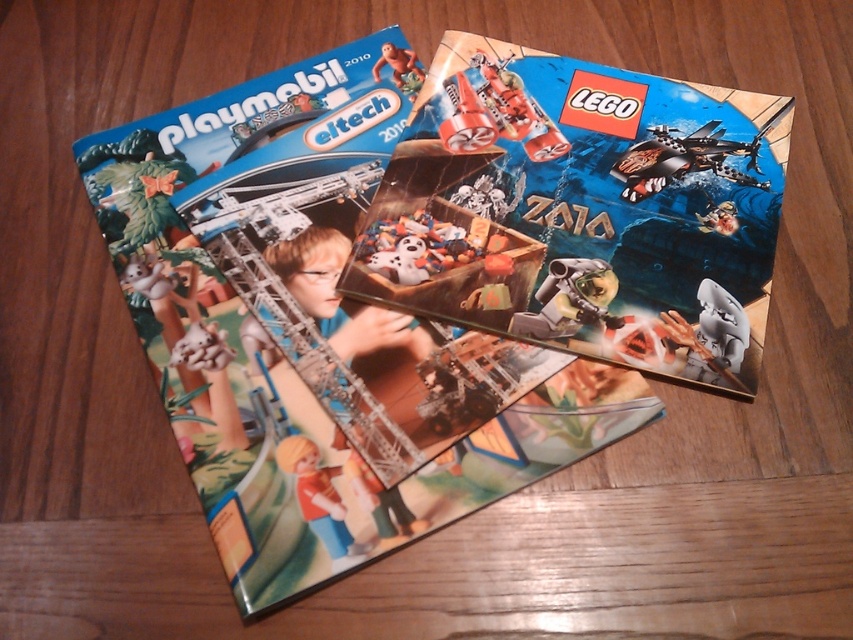
Is shiny metallic airplane at upper right shorter than white plastic shark fin at center?

Yes.

Locate an element on the screen. shiny metallic airplane at upper right is located at coordinates (683, 160).

Is point (628, 189) behind point (705, 300)?

That is True.

The width and height of the screenshot is (853, 640). What are the coordinates of `shiny metallic airplane at upper right` in the screenshot? It's located at (683, 160).

Which is below, shiny metallic airplane at upper right or matte plastic toy at center?

Positioned lower is matte plastic toy at center.

Is shiny metallic airplane at upper right thinner than matte plastic toy at center?

No.

Is point (656, 168) more distant than point (349, 563)?

That is True.

Find the location of a particular element. shiny metallic airplane at upper right is located at coordinates (683, 160).

Which is below, matte plastic lego catalog at center or plastic/smooth robot at center?

plastic/smooth robot at center is below.

Which is more to the right, matte plastic lego catalog at center or plastic/smooth robot at center?

matte plastic lego catalog at center

You are a GUI agent. You are given a task and a screenshot of the screen. Output one action in this format:
    pyautogui.click(x=<x>, y=<y>)
    Task: Click on the matte plastic lego catalog at center
    
    Given the screenshot: What is the action you would take?
    pyautogui.click(x=583, y=211)